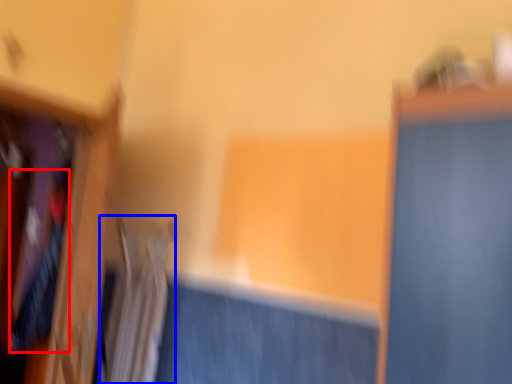
Question: Which object is further to the camera taking this photo, clothing (highlighted by a red box) or radiator (highlighted by a blue box)?

Choices:
 (A) clothing
 (B) radiator

Answer: (A)